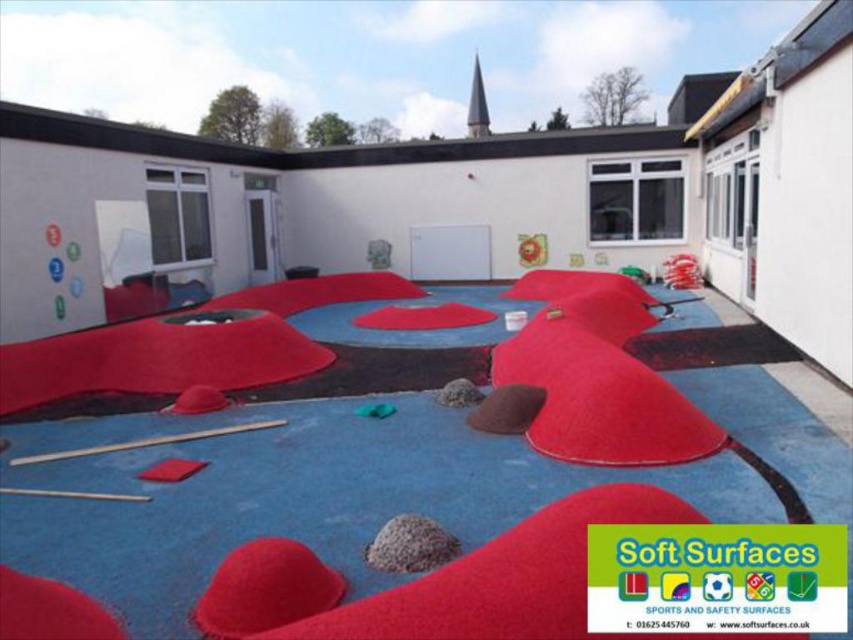
Question: Among these points, which one is nearest to the camera?

Choices:
 (A) (218, 362)
 (B) (380, 403)
 (C) (445, 317)

Answer: (B)

Question: Is red rubberized mat at center to the left of green rubber ball at center from the viewer's perspective?

Choices:
 (A) yes
 (B) no

Answer: (B)

Question: Can you confirm if red rubberized mat at center is positioned to the left of green rubber ball at center?

Choices:
 (A) yes
 (B) no

Answer: (B)

Question: Is red rubberized mat at center bigger than green rubber ball at center?

Choices:
 (A) yes
 (B) no

Answer: (A)

Question: Which point is farther to the camera?

Choices:
 (A) red rubberized mat at center
 (B) velvet red carpet at center

Answer: (A)

Question: Which point appears closest to the camera in this image?

Choices:
 (A) (363, 410)
 (B) (401, 307)
 (C) (236, 362)

Answer: (A)